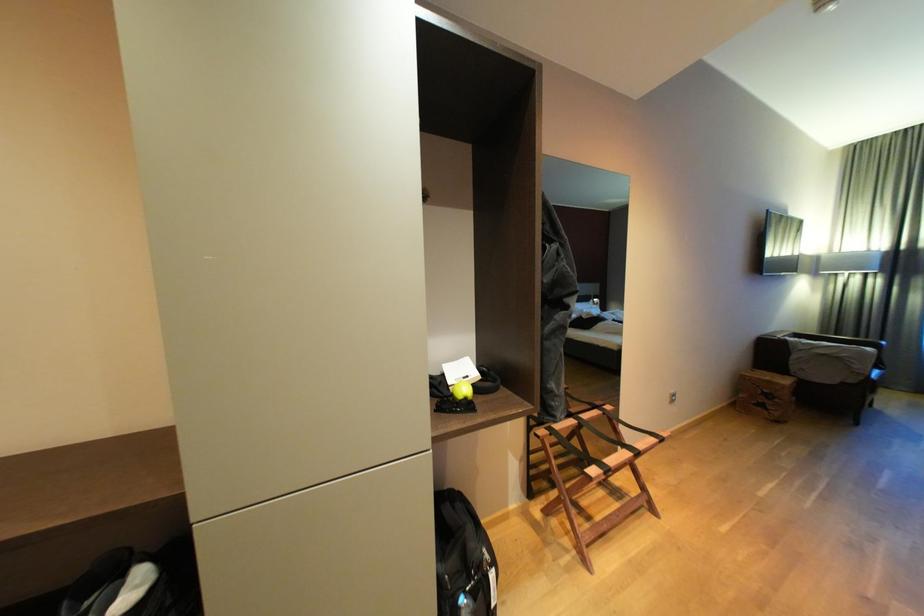
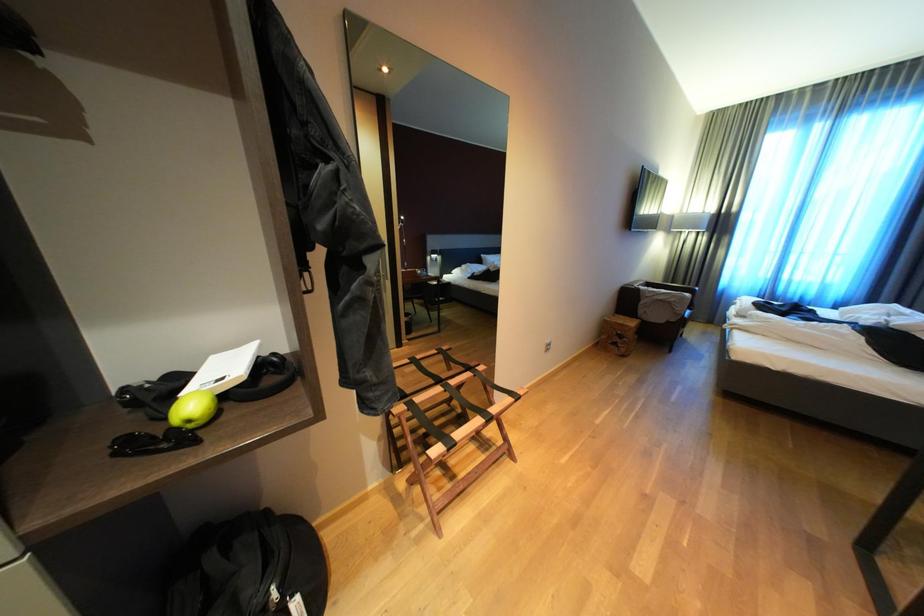
Question: The camera is either moving clockwise (left) or counter-clockwise (right) around the object. The first image is from the beginning of the video and the second image is from the end. Is the camera moving left or right when shooting the video?

Choices:
 (A) Left
 (B) Right

Answer: (A)